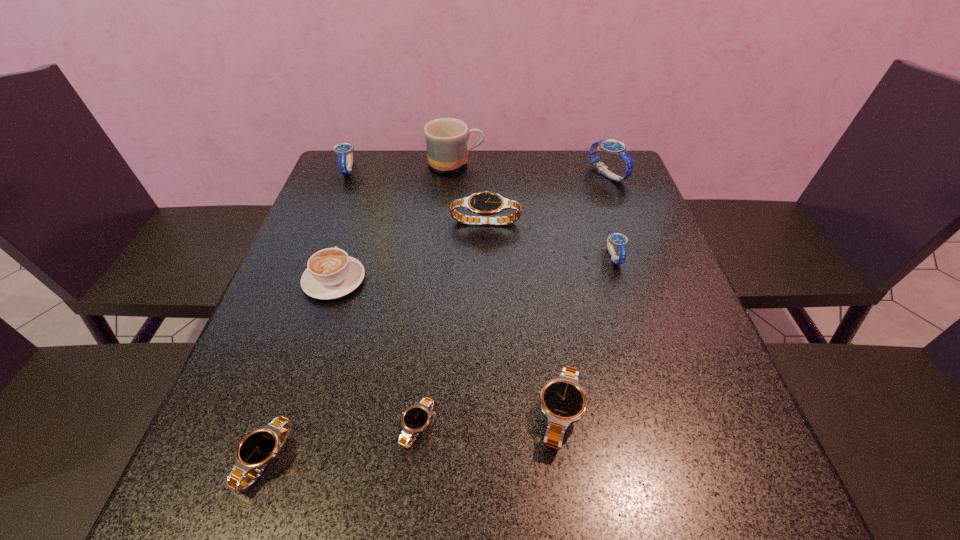
Identify the location of the tallest object. (446, 139).

Find the location of a particular element. mug is located at coordinates (446, 139).

Where is `the second tallest object`? the second tallest object is located at coordinates (614, 147).

This screenshot has height=540, width=960. I want to click on the biggest blue watch, so click(x=614, y=147).

At what (x,y) coordinates should I click in order to perform the action: click on the second smallest blue watch. Please return your answer as a coordinate pair (x, y). This screenshot has width=960, height=540. Looking at the image, I should click on (344, 150).

Locate an element on the screen. The image size is (960, 540). the third farthest watch is located at coordinates (486, 203).

Locate an element on the screen. The image size is (960, 540). the fourth farthest object is located at coordinates (486, 203).

I want to click on white cappuccino, so click(331, 273).

Where is `the fourth farthest watch`? The image size is (960, 540). the fourth farthest watch is located at coordinates (619, 240).

The width and height of the screenshot is (960, 540). I want to click on the smallest blue watch, so tap(619, 240).